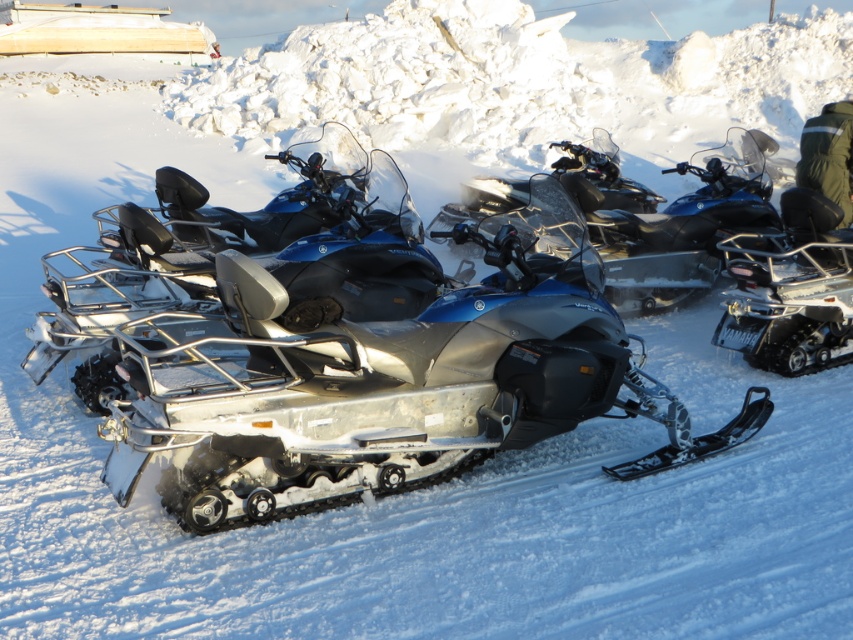
From the picture: Can you confirm if glossy metallic snowmobile at center is wider than silver metallic snowmobile at right?

Yes, glossy metallic snowmobile at center is wider than silver metallic snowmobile at right.

Which is in front, point (631, 196) or point (792, 240)?

Point (792, 240) is in front.

This screenshot has width=853, height=640. What are the coordinates of `glossy metallic snowmobile at center` in the screenshot? It's located at (666, 216).

Based on the photo, does silver metallic snowmobile at right appear on the right side of green fabric jacket at upper right?

Incorrect, silver metallic snowmobile at right is not on the right side of green fabric jacket at upper right.

Does silver metallic snowmobile at right appear on the left side of green fabric jacket at upper right?

Indeed, silver metallic snowmobile at right is positioned on the left side of green fabric jacket at upper right.

Does point (811, 346) lie behind point (828, 109)?

No, (811, 346) is closer to viewer.

This screenshot has height=640, width=853. I want to click on silver metallic snowmobile at right, so click(x=790, y=289).

Does glossy metallic snowmobile at center appear under green fabric jacket at upper right?

Indeed, glossy metallic snowmobile at center is positioned under green fabric jacket at upper right.

Is point (717, 218) closer to viewer compared to point (843, 125)?

That is False.

Locate an element on the screen. glossy metallic snowmobile at center is located at coordinates (666, 216).